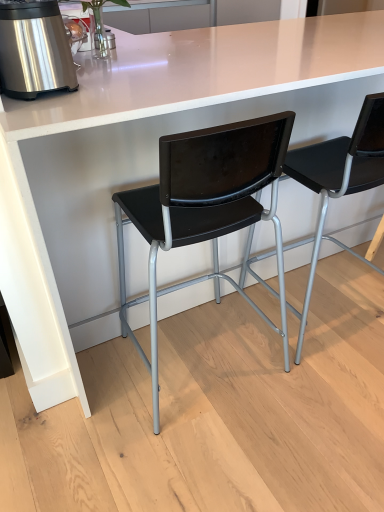
Where is `unoccupied region to the right of black plastic chair at center, which is counted as the 2th chair, starting from the right`? The height and width of the screenshot is (512, 384). unoccupied region to the right of black plastic chair at center, which is counted as the 2th chair, starting from the right is located at coordinates (317, 390).